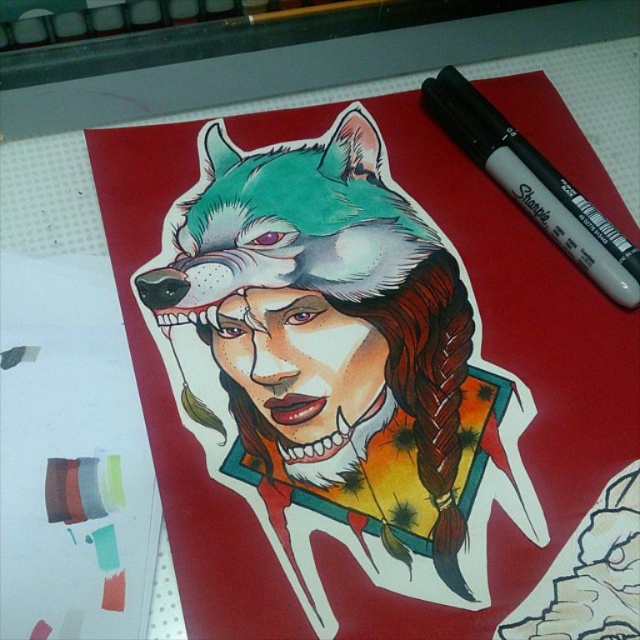
Question: Is shiny metallic wolf head at center in front of black marker at upper right?

Choices:
 (A) no
 (B) yes

Answer: (B)

Question: Can you confirm if shiny metallic wolf head at center is positioned below black marker at upper right?

Choices:
 (A) yes
 (B) no

Answer: (A)

Question: Which point is closer to the camera taking this photo?

Choices:
 (A) (611, 262)
 (B) (394, 452)

Answer: (B)

Question: Does shiny metallic wolf head at center have a greater width compared to black marker at upper right?

Choices:
 (A) yes
 (B) no

Answer: (A)

Question: Which of the following is the farthest from the observer?

Choices:
 (A) (422, 403)
 (B) (492, 160)

Answer: (B)